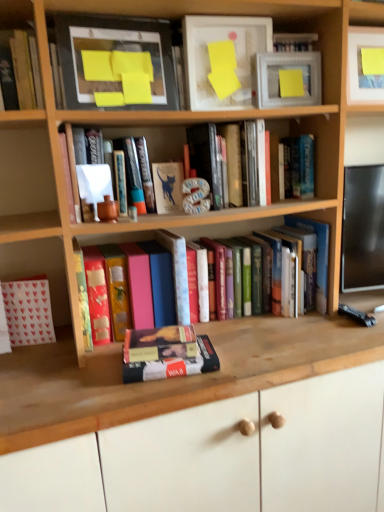
Question: Is matte white picture frame at upper right, positioned as the 2th picture frame in left-to-right order, in front of or behind matte white book at upper center, the third book from the right, in the image?

Choices:
 (A) front
 (B) behind

Answer: (B)

Question: Considering the relative positions of matte white picture frame at upper right, positioned as the 2th picture frame in left-to-right order, and matte white book at upper center, which appears as the third book when viewed from the left, in the image provided, is matte white picture frame at upper right, positioned as the 2th picture frame in left-to-right order, to the left or to the right of matte white book at upper center, which appears as the third book when viewed from the left,?

Choices:
 (A) right
 (B) left

Answer: (A)

Question: Estimate the real-world distances between objects in this image. Which object is farther from the pink matte book at center, placed as the 2th paperback book when sorted from left to right?

Choices:
 (A) matte yellow paper at upper center, positioned as the 1th paperback book in top-to-bottom order
 (B) matte black picture frame at upper left, which ranks as the first picture frame in left-to-right order
 (C) matte white book at upper center, which appears as the third book when viewed from the left
 (D) wooden at lower center
 (E) white paper bag at lower left, which appears as the 1th book when viewed from the left

Answer: (A)

Question: Which is farther from the hardcover book at upper left, which is the 4th book in right-to-left order?

Choices:
 (A) hardcover book at center, positioned as the 1th book in right-to-left order
 (B) hardcover book at center, which is the 4th book in left-to-right order
 (C) matte white book at upper center, which appears as the third book when viewed from the left
 (D) hardcover book at center, which is counted as the 3th paperback book, starting from the right
 (E) wooden at lower center

Answer: (E)